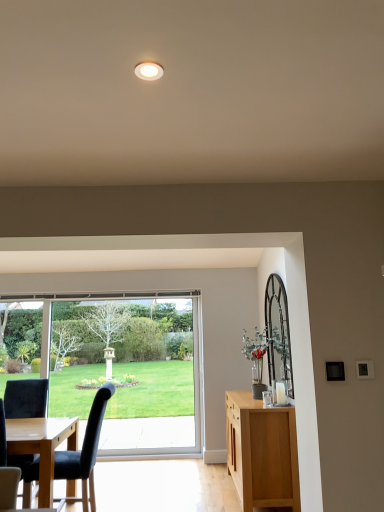
The image size is (384, 512). Find the location of `black leather chair at lower left, placed as the second chair when sorted from right to left`. black leather chair at lower left, placed as the second chair when sorted from right to left is located at coordinates (7, 470).

Locate an element on the screen. black fabric chair at left, which appears as the first chair when viewed from the right is located at coordinates (84, 452).

The width and height of the screenshot is (384, 512). Describe the element at coordinates (84, 452) in the screenshot. I see `black fabric chair at left, positioned as the second chair in left-to-right order` at that location.

Find the location of a particular element. The width and height of the screenshot is (384, 512). green leafy plant in glass vase at right is located at coordinates (265, 352).

Is clear glass window at center aimed at black leather chair at lower left, which ranks as the first chair in left-to-right order?

Yes, clear glass window at center is aimed at black leather chair at lower left, which ranks as the first chair in left-to-right order.

Is clear glass window at center outside of black leather chair at lower left, which ranks as the first chair in left-to-right order?

Yes, clear glass window at center is not within black leather chair at lower left, which ranks as the first chair in left-to-right order.

Considering the positions of objects clear glass window at center and black leather chair at lower left, which ranks as the first chair in left-to-right order, in the image provided, who is in front, clear glass window at center or black leather chair at lower left, which ranks as the first chair in left-to-right order,?

Positioned in front is black leather chair at lower left, which ranks as the first chair in left-to-right order.

In order to click on the 2nd chair positioned below the clear glass window at center (from the image's perspective) in this screenshot , I will do `click(7, 470)`.

Does light brown wood cabinet at right come behind white glossy light fixture at upper center?

Yes, light brown wood cabinet at right is further from the camera.

Can you confirm if light brown wood cabinet at right is bigger than white glossy light fixture at upper center?

Correct, light brown wood cabinet at right is larger in size than white glossy light fixture at upper center.

How distant is light brown wood cabinet at right from white glossy light fixture at upper center?

They are 3.48 meters apart.

Between light brown wood cabinet at right and white glossy light fixture at upper center, which one appears on the right side from the viewer's perspective?

Positioned to the right is light brown wood cabinet at right.

Is clear glass window at center in contact with white glossy light fixture at upper center?

They are not placed beside each other.

Is clear glass window at center in front of white glossy light fixture at upper center?

No.

Is clear glass window at center situated inside white glossy light fixture at upper center or outside?

clear glass window at center is not inside white glossy light fixture at upper center, it's outside.

Is light brown wood cabinet at right bigger than black fabric chair at left, positioned as the second chair in left-to-right order?

Yes, light brown wood cabinet at right is bigger than black fabric chair at left, positioned as the second chair in left-to-right order.

Is black fabric chair at left, positioned as the second chair in left-to-right order, surrounded by light brown wood cabinet at right?

That's incorrect, black fabric chair at left, positioned as the second chair in left-to-right order, is not inside light brown wood cabinet at right.

In the scene shown: In terms of width, does light brown wood cabinet at right look wider or thinner when compared to black fabric chair at left, positioned as the second chair in left-to-right order?

In the image, light brown wood cabinet at right appears to be more narrow than black fabric chair at left, positioned as the second chair in left-to-right order.

Looking at this image, considering the relative positions of white glossy light fixture at upper center and light brown wood cabinet at right in the image provided, is white glossy light fixture at upper center to the left of light brown wood cabinet at right from the viewer's perspective?

Correct, you'll find white glossy light fixture at upper center to the left of light brown wood cabinet at right.

Locate an element on the screen. This screenshot has width=384, height=512. cabinetry on the right of white glossy light fixture at upper center is located at coordinates (262, 452).

Consider the image. Is white glossy light fixture at upper center located outside light brown wood cabinet at right?

Yes, white glossy light fixture at upper center is outside of light brown wood cabinet at right.

Where is `window behind the green leafy plant in glass vase at right`? Image resolution: width=384 pixels, height=512 pixels. window behind the green leafy plant in glass vase at right is located at coordinates pyautogui.click(x=116, y=366).

Considering the positions of objects green leafy plant in glass vase at right and clear glass window at center in the image provided, who is in front, green leafy plant in glass vase at right or clear glass window at center?

Positioned in front is green leafy plant in glass vase at right.

Between green leafy plant in glass vase at right and clear glass window at center, which one has smaller size?

With smaller size is green leafy plant in glass vase at right.

Is green leafy plant in glass vase at right facing towards clear glass window at center?

No, green leafy plant in glass vase at right does not turn towards clear glass window at center.

What's the angular difference between black leather chair at lower left, placed as the second chair when sorted from right to left, and clear glass window at center's facing directions?

black leather chair at lower left, placed as the second chair when sorted from right to left, and clear glass window at center are facing 1.44 degrees away from each other.

From a real-world perspective, is black leather chair at lower left, placed as the second chair when sorted from right to left, over clear glass window at center?

No, from a real-world perspective, black leather chair at lower left, placed as the second chair when sorted from right to left, is not over clear glass window at center

From the image's perspective, is black leather chair at lower left, placed as the second chair when sorted from right to left, over clear glass window at center?

No.

Considering the points (4, 470) and (175, 347), which point is in front, point (4, 470) or point (175, 347)?

Point (4, 470)

Find the location of a particular element. chair that is the 2nd one when counting downward from the clear glass window at center (from the image's perspective) is located at coordinates [7, 470].

Where is `cabinetry below the white glossy light fixture at upper center (from a real-world perspective)`? cabinetry below the white glossy light fixture at upper center (from a real-world perspective) is located at coordinates pyautogui.click(x=262, y=452).

Estimate the real-world distances between objects in this image. Which object is closer to green leafy plant in glass vase at right, black fabric chair at left, positioned as the second chair in left-to-right order, or light brown wood cabinet at right?

The object closer to green leafy plant in glass vase at right is light brown wood cabinet at right.

Estimate the real-world distances between objects in this image. Which object is further from light brown wood cabinet at right, green leafy plant in glass vase at right or black fabric chair at left, positioned as the second chair in left-to-right order?

black fabric chair at left, positioned as the second chair in left-to-right order, lies further to light brown wood cabinet at right than the other object.

Consider the image. Estimate the real-world distances between objects in this image. Which object is closer to black fabric chair at left, positioned as the second chair in left-to-right order, black leather chair at lower left, placed as the second chair when sorted from right to left, or white glossy light fixture at upper center?

Based on the image, black leather chair at lower left, placed as the second chair when sorted from right to left, appears to be nearer to black fabric chair at left, positioned as the second chair in left-to-right order.

Estimate the real-world distances between objects in this image. Which object is further from black leather chair at lower left, placed as the second chair when sorted from right to left, clear glass window at center or green leafy plant in glass vase at right?

green leafy plant in glass vase at right is positioned further to the anchor black leather chair at lower left, placed as the second chair when sorted from right to left.

When comparing their distances from black fabric chair at left, positioned as the second chair in left-to-right order, does light brown wood cabinet at right or green leafy plant in glass vase at right seem further?

The object further to black fabric chair at left, positioned as the second chair in left-to-right order, is green leafy plant in glass vase at right.

Based on their spatial positions, is white glossy light fixture at upper center or clear glass window at center closer to light brown wood cabinet at right?

The object closer to light brown wood cabinet at right is clear glass window at center.

In the scene shown: Based on their spatial positions, is green leafy plant in glass vase at right or black leather chair at lower left, which ranks as the first chair in left-to-right order, further from light brown wood cabinet at right?

A: Based on the image, black leather chair at lower left, which ranks as the first chair in left-to-right order, appears to be further to light brown wood cabinet at right.

Based on their spatial positions, is black fabric chair at left, positioned as the second chair in left-to-right order, or light brown wood cabinet at right closer to white glossy light fixture at upper center?

light brown wood cabinet at right.

Image resolution: width=384 pixels, height=512 pixels. I want to click on cabinetry between white glossy light fixture at upper center and green leafy plant in glass vase at right along the z-axis, so click(262, 452).

I want to click on cabinetry between black fabric chair at left, positioned as the second chair in left-to-right order, and clear glass window at center, along the z-axis, so [x=262, y=452].

Identify the location of cabinetry between white glossy light fixture at upper center and black leather chair at lower left, placed as the second chair when sorted from right to left, vertically. (262, 452).

Find the location of a particular element. chair located between black leather chair at lower left, which ranks as the first chair in left-to-right order, and green leafy plant in glass vase at right in the left-right direction is located at coordinates (84, 452).